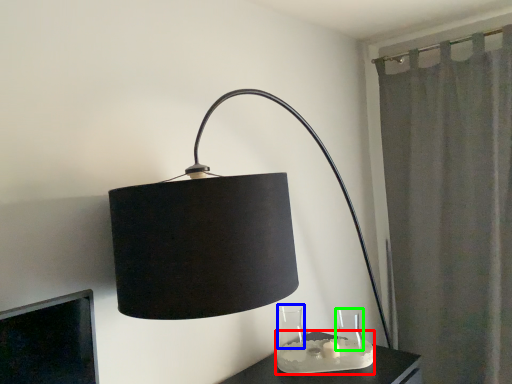
Question: Which is nearer to the candle holder (highlighted by a red box)? glass vase (highlighted by a blue box) or glass vase (highlighted by a green box).

Choices:
 (A) glass vase
 (B) glass vase

Answer: (A)